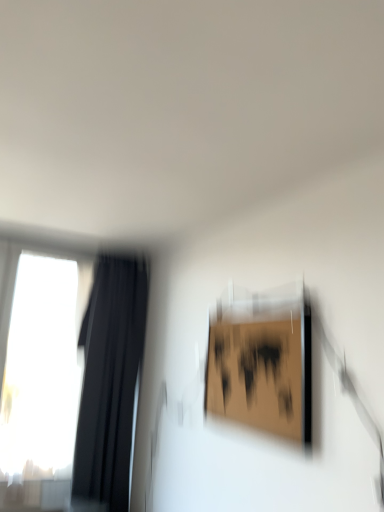
Question: Should I look upward or downward to see black fabric curtain at left?

Choices:
 (A) down
 (B) up

Answer: (A)

Question: Is black fabric curtain at left to the right of transparent glass window at left from the viewer's perspective?

Choices:
 (A) yes
 (B) no

Answer: (A)

Question: Does black fabric curtain at left have a larger size compared to transparent glass window at left?

Choices:
 (A) yes
 (B) no

Answer: (A)

Question: Does black fabric curtain at left have a lesser height compared to transparent glass window at left?

Choices:
 (A) no
 (B) yes

Answer: (A)

Question: Considering the relative positions of black fabric curtain at left and transparent glass window at left in the image provided, is black fabric curtain at left to the left of transparent glass window at left from the viewer's perspective?

Choices:
 (A) no
 (B) yes

Answer: (A)

Question: Does black fabric curtain at left have a smaller size compared to transparent glass window at left?

Choices:
 (A) yes
 (B) no

Answer: (B)

Question: From a real-world perspective, is black fabric curtain at left located higher than transparent glass window at left?

Choices:
 (A) no
 (B) yes

Answer: (A)

Question: Is transparent glass window at left completely or partially inside wooden frame at upper right?

Choices:
 (A) yes
 (B) no

Answer: (B)

Question: From the image's perspective, is wooden frame at upper right on transparent glass window at left?

Choices:
 (A) yes
 (B) no

Answer: (A)

Question: Is wooden frame at upper right closer to the viewer compared to transparent glass window at left?

Choices:
 (A) no
 (B) yes

Answer: (B)

Question: Could you tell me if wooden frame at upper right is facing transparent glass window at left?

Choices:
 (A) yes
 (B) no

Answer: (B)

Question: Considering the relative positions of wooden frame at upper right and transparent glass window at left in the image provided, is wooden frame at upper right to the right of transparent glass window at left from the viewer's perspective?

Choices:
 (A) no
 (B) yes

Answer: (B)

Question: Can you confirm if wooden frame at upper right is wider than transparent glass window at left?

Choices:
 (A) no
 (B) yes

Answer: (A)

Question: Is the position of transparent glass window at left more distant than that of black fabric curtain at left?

Choices:
 (A) no
 (B) yes

Answer: (B)